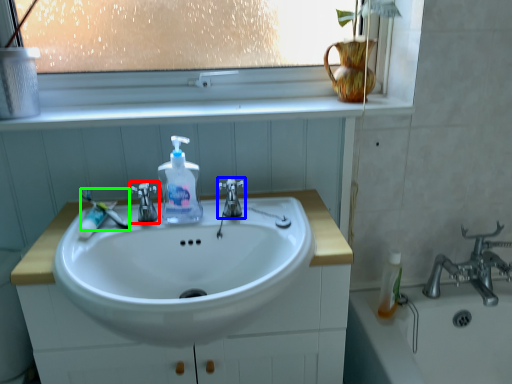
Question: Considering the real-world distances, which object is closest to tap (highlighted by a red box)? tap (highlighted by a blue box) or toothbrush (highlighted by a green box).

Choices:
 (A) tap
 (B) toothbrush

Answer: (B)